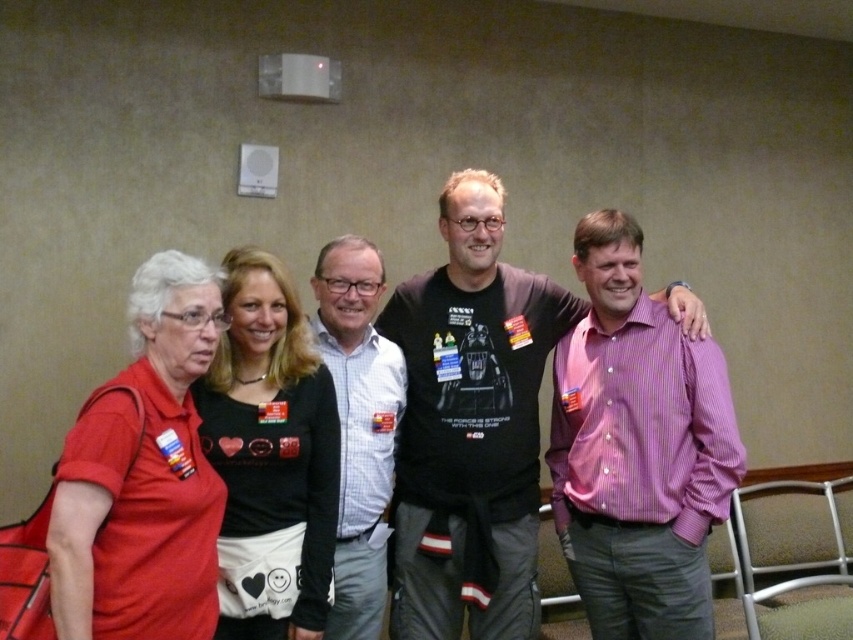
Question: Which point is closer to the camera?

Choices:
 (A) (660, 353)
 (B) (210, 458)
 (C) (354, 474)

Answer: (B)

Question: Which object is closer to the camera taking this photo?

Choices:
 (A) matte red shirt at left
 (B) pink striped shirt at center

Answer: (A)

Question: Does black t-shirt at center appear on the left side of pink striped shirt at center?

Choices:
 (A) yes
 (B) no

Answer: (A)

Question: Is black matte shirt at center to the left of white striped shirt at center from the viewer's perspective?

Choices:
 (A) no
 (B) yes

Answer: (B)

Question: Which of these objects is positioned closest to the matte red shirt at left?

Choices:
 (A) pink striped shirt at center
 (B) black matte shirt at center

Answer: (B)

Question: Can you confirm if black matte shirt at center is positioned to the left of white striped shirt at center?

Choices:
 (A) no
 (B) yes

Answer: (B)